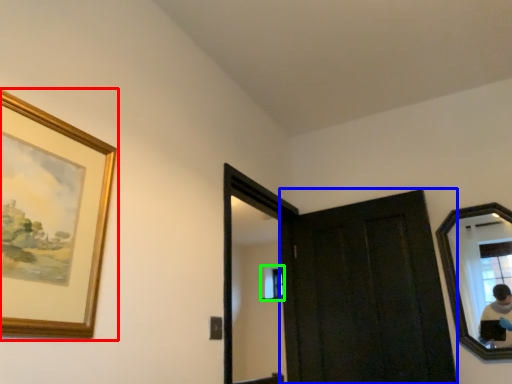
Question: Considering the real-world distances, which object is closest to picture frame (highlighted by a red box)? door (highlighted by a blue box) or window (highlighted by a green box).

Choices:
 (A) door
 (B) window

Answer: (A)